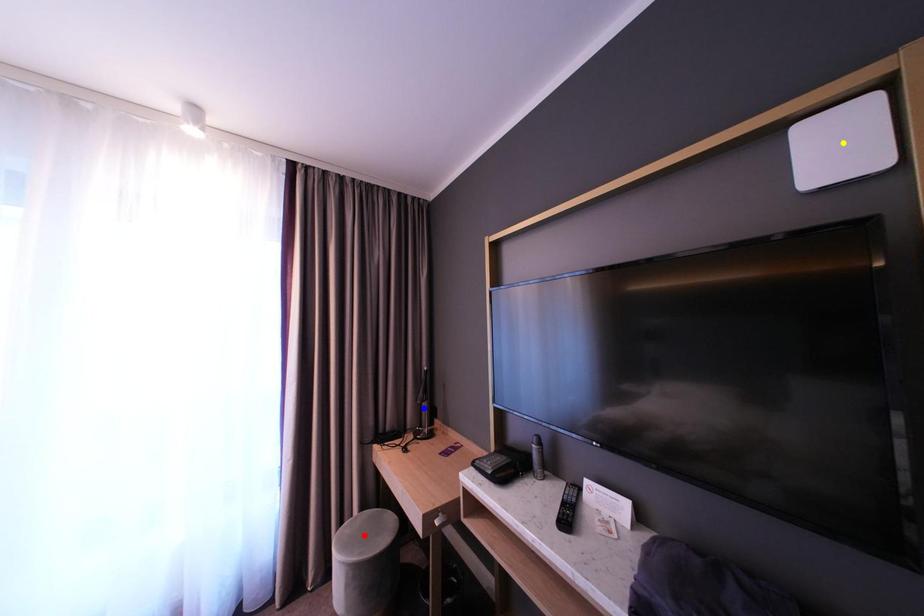
Order these from nearest to farthest:
- yellow point
- blue point
- red point

yellow point < red point < blue point